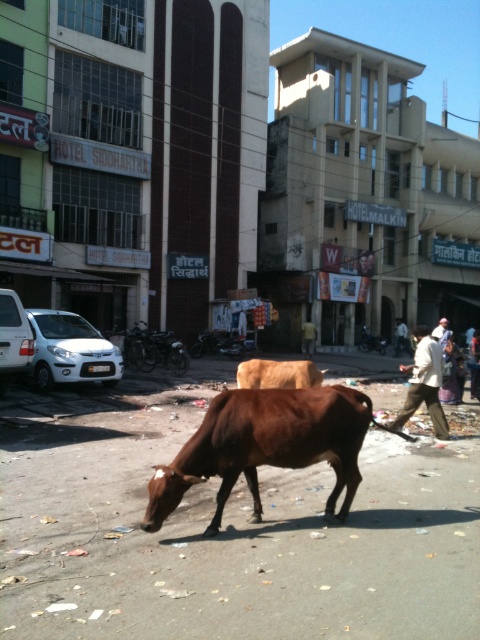
Is brown matte bull at center in front of light beige pants at center?

Yes, brown matte bull at center is in front of light beige pants at center.

Who is more forward, (356, 452) or (424, 381)?

Point (356, 452) is in front.

This screenshot has height=640, width=480. What are the coordinates of `brown matte bull at center` in the screenshot? It's located at click(266, 445).